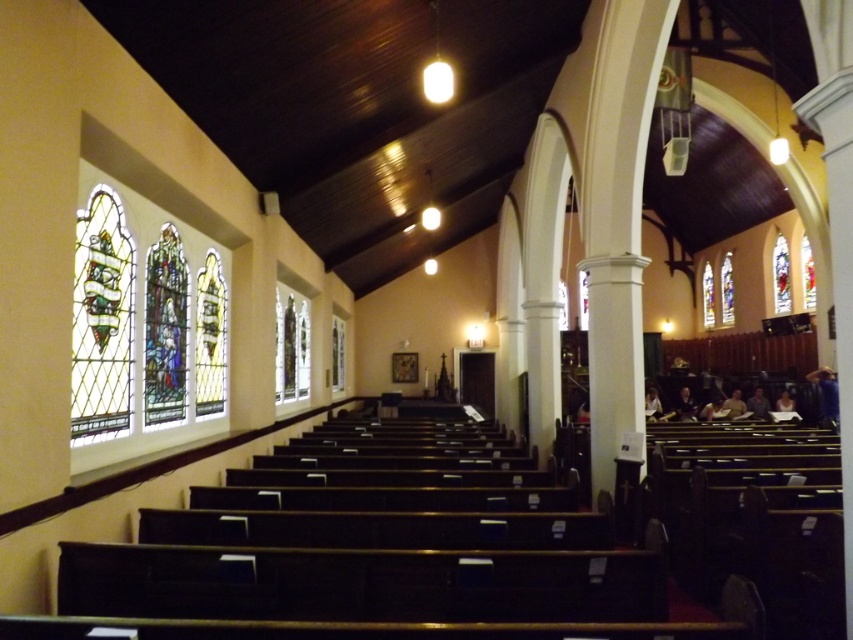
You are standing in the church and want to take a photo of both the stained glass at left and the stained glass window at right. Which one will appear larger in your camera viewfinder?

The stained glass at left will appear larger in the camera viewfinder because it is much taller than the stained glass window at right.

You are an architect designing a new church. You want to install a 10 meter long decorative beam between the stained glass at left and the stained glass window at right. Is there enough space between them to place the beam?

The stained glass at left and stained glass window at right are 14.27 meters apart, so yes, the 10 meter long decorative beam can be placed between them since it is shorter than the distance between the two stained glasses.

You are standing in the church and want to take a photo of the stained glass window at left. Your camera has a maximum focus distance of 4 meters. Can you capture a clear photo without moving closer?

The distance between you and the stained glass window at left is 4.28 meters, which exceeds the camera maximum focus distance of 4 meters. Therefore, you cannot capture a clear photo without moving closer.